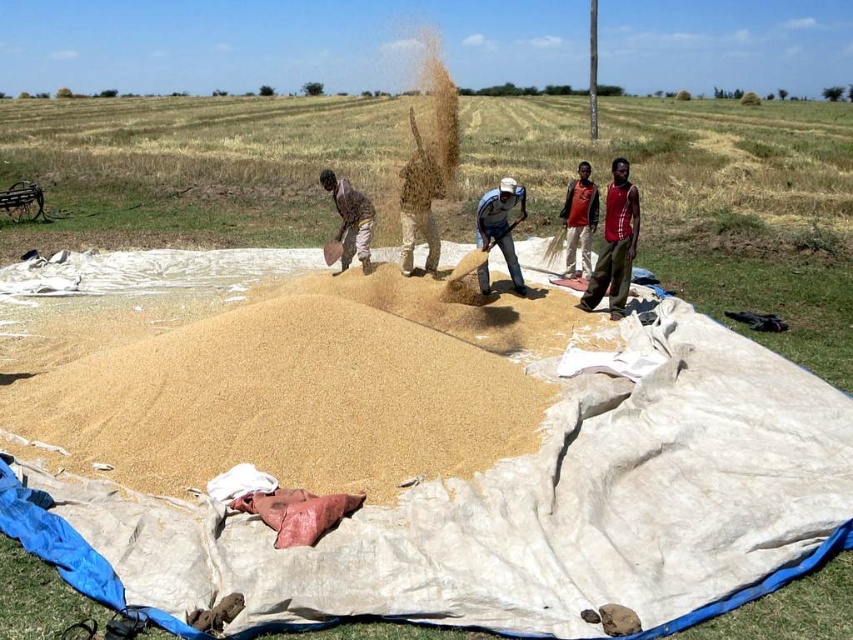
Does point (541, 406) lie in front of point (614, 273)?

Yes, it is.

Is point (177, 440) positioned after point (593, 280)?

No, it is not.

Is point (527, 346) behind point (608, 284)?

No, it is in front of (608, 284).

In order to click on golden sand at center in this screenshot , I will do `click(305, 388)`.

Does brown fabric bag at center appear over red fabric shirt at center?

Indeed, brown fabric bag at center is positioned over red fabric shirt at center.

Which is behind, point (347, 230) or point (567, 241)?

The point (347, 230) is behind.

The height and width of the screenshot is (640, 853). I want to click on brown fabric bag at center, so click(350, 218).

Identify the location of brown fabric bag at center. The width and height of the screenshot is (853, 640). (350, 218).

Which is more to the right, golden sand at center or light blue fabric at center?

Positioned to the right is light blue fabric at center.

Identify the location of golden sand at center. (305, 388).

Between point (476, 358) and point (483, 205), which one is positioned behind?

The point (483, 205) is more distant.

This screenshot has height=640, width=853. I want to click on golden sand at center, so click(x=305, y=388).